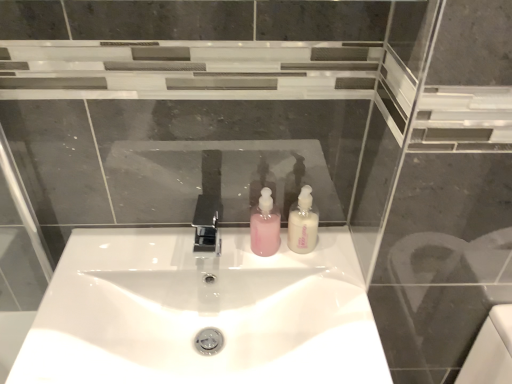
Question: Is polished chrome tap at center shorter than white glossy soap dispenser at center, the first soap dispenser from the right?

Choices:
 (A) yes
 (B) no

Answer: (A)

Question: Is the position of polished chrome tap at center more distant than that of white glossy soap dispenser at center, the first soap dispenser from the right?

Choices:
 (A) no
 (B) yes

Answer: (A)

Question: Is polished chrome tap at center wider than white glossy soap dispenser at center, the 2th soap dispenser in the left-to-right sequence?

Choices:
 (A) no
 (B) yes

Answer: (B)

Question: From a real-world perspective, does polished chrome tap at center sit lower than white glossy soap dispenser at center, the first soap dispenser from the right?

Choices:
 (A) yes
 (B) no

Answer: (A)

Question: Is polished chrome tap at center smaller than white glossy soap dispenser at center, the 2th soap dispenser in the left-to-right sequence?

Choices:
 (A) no
 (B) yes

Answer: (A)

Question: Is white glossy sink at center taller or shorter than white glossy soap dispenser at center, the 2th soap dispenser in the left-to-right sequence?

Choices:
 (A) tall
 (B) short

Answer: (A)

Question: From the image's perspective, is white glossy sink at center located above or below white glossy soap dispenser at center, the first soap dispenser from the right?

Choices:
 (A) below
 (B) above

Answer: (A)

Question: Is white glossy sink at center inside the boundaries of white glossy soap dispenser at center, the 2th soap dispenser in the left-to-right sequence, or outside?

Choices:
 (A) outside
 (B) inside

Answer: (A)

Question: Is white glossy sink at center wider or thinner than white glossy soap dispenser at center, the 2th soap dispenser in the left-to-right sequence?

Choices:
 (A) thin
 (B) wide

Answer: (B)

Question: Considering the positions of point (212, 249) and point (302, 223), is point (212, 249) closer or farther from the camera than point (302, 223)?

Choices:
 (A) closer
 (B) farther

Answer: (B)

Question: From a real-world perspective, is polished chrome tap at center above or below white glossy soap dispenser at center, the 2th soap dispenser in the left-to-right sequence?

Choices:
 (A) below
 (B) above

Answer: (A)

Question: Considering the positions of polished chrome tap at center and white glossy soap dispenser at center, the first soap dispenser from the right, in the image, is polished chrome tap at center wider or thinner than white glossy soap dispenser at center, the first soap dispenser from the right,?

Choices:
 (A) wide
 (B) thin

Answer: (A)

Question: Would you say polished chrome tap at center is to the left or to the right of white glossy soap dispenser at center, the first soap dispenser from the right, in the picture?

Choices:
 (A) left
 (B) right

Answer: (A)

Question: In terms of width, does white glossy sink at center look wider or thinner when compared to pink matte soap dispenser at center, which appears as the first soap dispenser when viewed from the left?

Choices:
 (A) wide
 (B) thin

Answer: (A)

Question: From a real-world perspective, relative to pink matte soap dispenser at center, the second soap dispenser when ordered from right to left, is white glossy sink at center vertically above or below?

Choices:
 (A) below
 (B) above

Answer: (A)